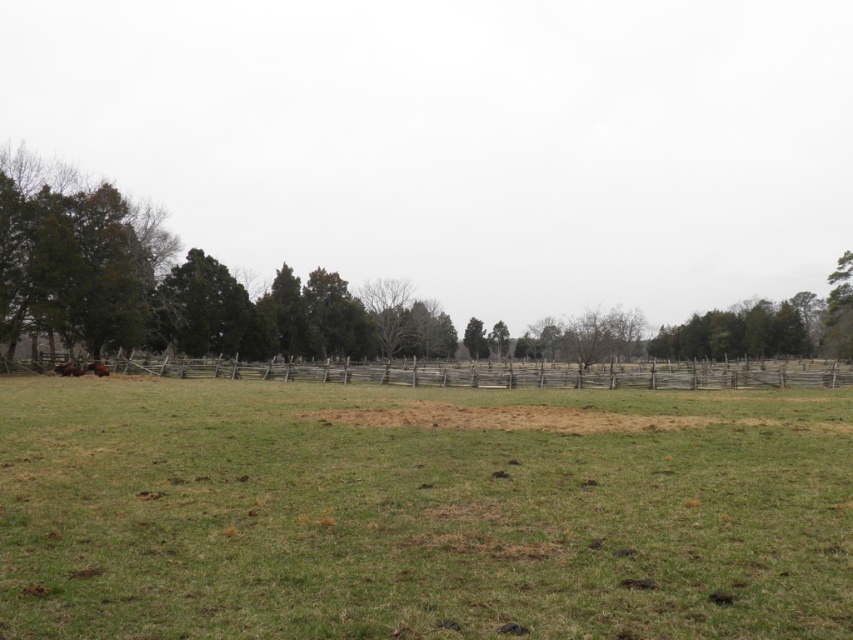
Is point (611, 332) closer to viewer compared to point (90, 365)?

No, it is behind (90, 365).

Is green leafy tree at left to the left of brown fuzzy cow at lower left from the viewer's perspective?

No, green leafy tree at left is not to the left of brown fuzzy cow at lower left.

Locate an element on the screen. The width and height of the screenshot is (853, 640). green leafy tree at left is located at coordinates (172, 284).

Image resolution: width=853 pixels, height=640 pixels. What are the coordinates of `green leafy tree at left` in the screenshot? It's located at [172, 284].

Does weathered wood fence at center have a smaller size compared to brown furry cow at lower left?

Incorrect, weathered wood fence at center is not smaller in size than brown furry cow at lower left.

Which is in front, point (544, 376) or point (73, 365)?

Point (544, 376) is in front.

What do you see at coordinates (508, 372) in the screenshot?
I see `weathered wood fence at center` at bounding box center [508, 372].

Identify the location of weathered wood fence at center. (508, 372).

Which is behind, point (479, 333) or point (56, 364)?

The point (479, 333) is behind.

Who is more distant from viewer, (x=102, y=284) or (x=62, y=371)?

The point (x=102, y=284) is more distant.

In order to click on green leafy tree at left in this screenshot , I will do `click(172, 284)`.